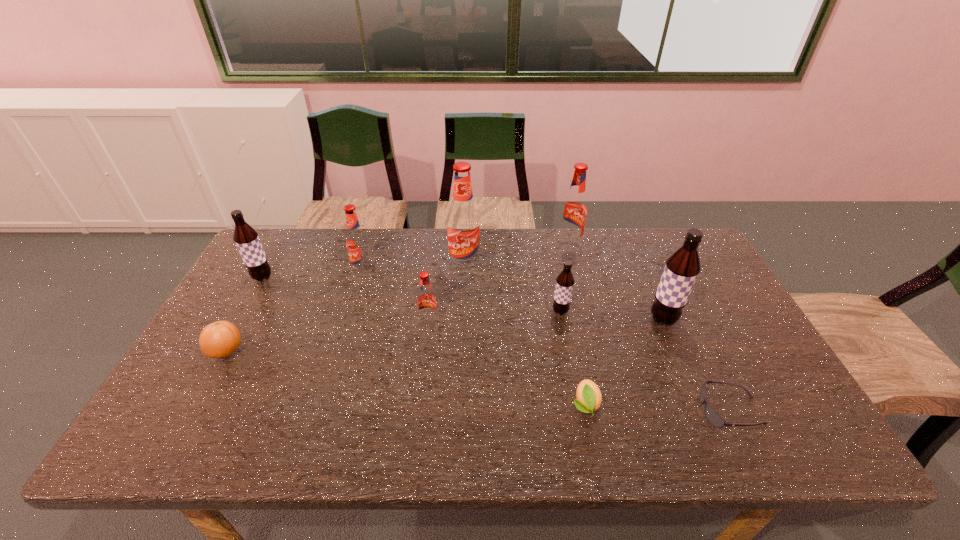
Identify the location of brown root beer identified as the closest to the leftmost red root beer. This screenshot has width=960, height=540. (246, 238).

At what (x,y) coordinates should I click in order to perform the action: click on free space that satisfies the following two spatial constraints: 1. on the front side of the leftmost brown root beer; 2. on the right side of the rightmost brown root beer. Please return your answer as a coordinate pair (x, y). Image resolution: width=960 pixels, height=540 pixels. Looking at the image, I should click on (239, 320).

Where is `vacant space that satisfies the following two spatial constraints: 1. on the back side of the third red root beer from right to left; 2. on the right side of the farthest red root beer`? The height and width of the screenshot is (540, 960). vacant space that satisfies the following two spatial constraints: 1. on the back side of the third red root beer from right to left; 2. on the right side of the farthest red root beer is located at coordinates (439, 246).